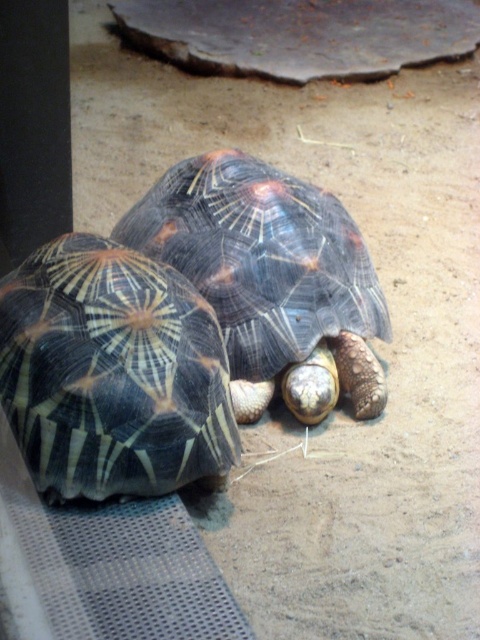
Is shiny black tortoise at center to the left of shiny dark tortoise at center from the viewer's perspective?

Correct, you'll find shiny black tortoise at center to the left of shiny dark tortoise at center.

Which is more to the left, shiny black tortoise at center or shiny dark tortoise at center?

Positioned to the left is shiny black tortoise at center.

Who is more distant from viewer, (12, 337) or (276, 272)?

Point (276, 272)

This screenshot has width=480, height=640. Find the location of `shiny black tortoise at center`. shiny black tortoise at center is located at coordinates 111,372.